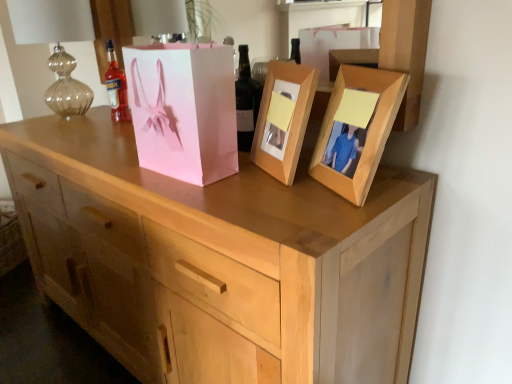
Question: Considering the relative positions of light wood chest of drawers at center and dark brown glass bottle at center, acting as the 1th bottle starting from the front, in the image provided, is light wood chest of drawers at center to the left or to the right of dark brown glass bottle at center, acting as the 1th bottle starting from the front,?

Choices:
 (A) right
 (B) left

Answer: (B)

Question: Is point (152, 193) positioned closer to the camera than point (257, 87)?

Choices:
 (A) farther
 (B) closer

Answer: (B)

Question: Which object is the farthest from the wooden photo frame at upper right, acting as the 1th picture frame starting from the right?

Choices:
 (A) pink paper bag at center
 (B) light wood chest of drawers at center
 (C) wooden photo frame at center, the second picture frame viewed from the right
 (D) dark brown glass bottle at center, marked as the second bottle in a back-to-front arrangement
 (E) translucent glass bottle at upper left, the 1th bottle positioned from the back

Answer: (E)

Question: Which of these objects is positioned farthest from the wooden photo frame at center, which is the 1th picture frame from left to right?

Choices:
 (A) dark brown glass bottle at center, the 1th bottle positioned from the right
 (B) translucent glass bottle at upper left, acting as the 2th bottle starting from the right
 (C) wooden photo frame at upper right, acting as the 1th picture frame starting from the right
 (D) pink paper bag at center
 (E) light wood chest of drawers at center

Answer: (B)